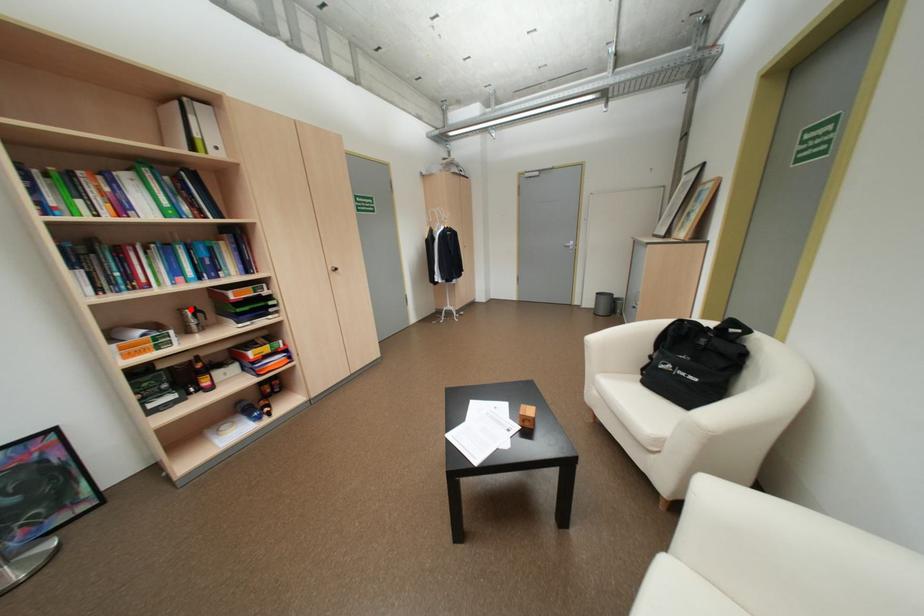
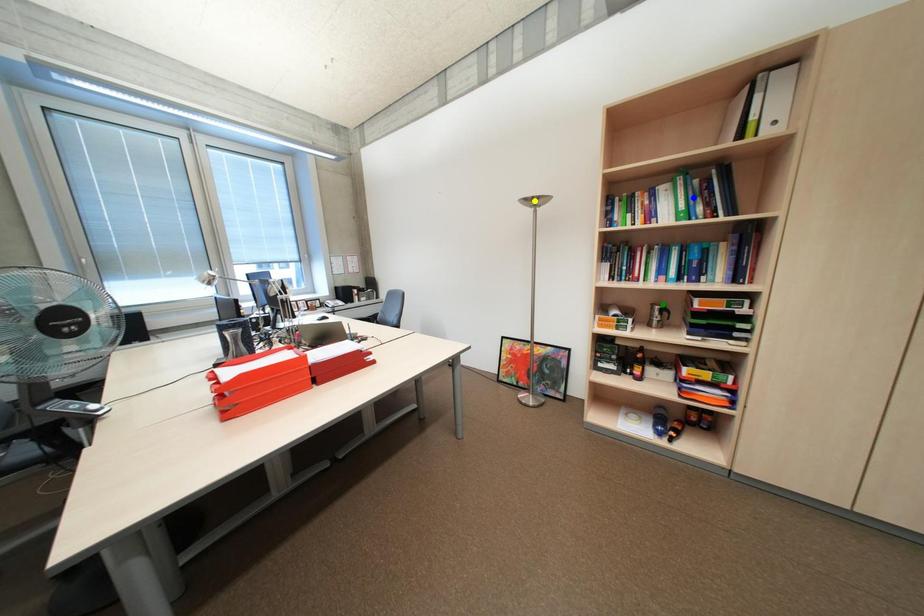
Question: I am providing you with two images of the same scene from different viewpoints. A red point is marked on the first image. You are given multiple points on the second image. Can you choose the point in image 2 that corresponds to the point in image 1?

Choices:
 (A) yellow point
 (B) blue point
 (C) green point

Answer: (C)